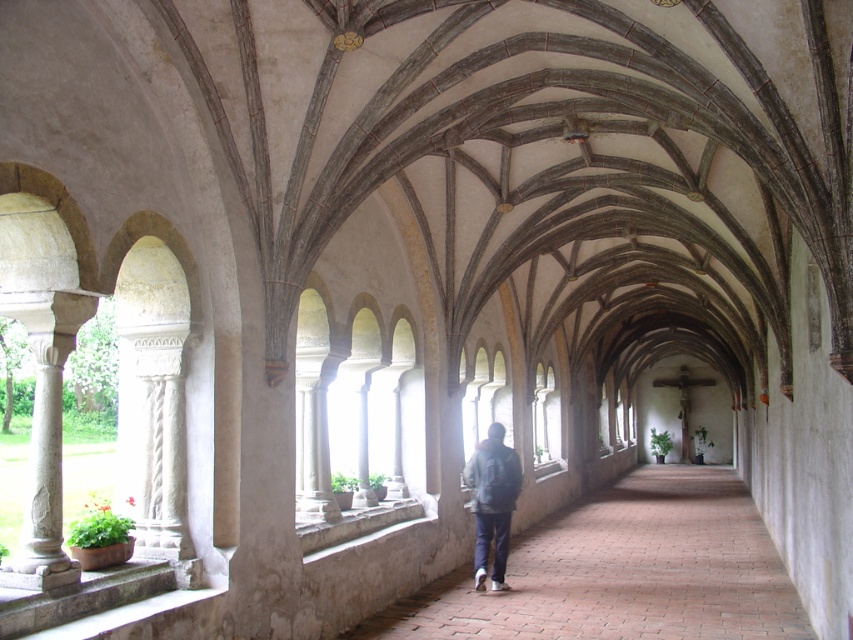
You are standing at the entrance of the walkway and see the point marked at coordinates (622, 572). What is located at that point?

The point at coordinates (622, 572) indicates the location of the brown brick path at center.

Based on the photo, you are standing at the entrance of the walkway and see the brown brick path at center and the dark blue denim jacket at center. Which object is located to the right of the other?

The brown brick path at center is positioned on the right side of the dark blue denim jacket at center, so the brown brick path at center is to the right of the dark blue denim jacket at center.